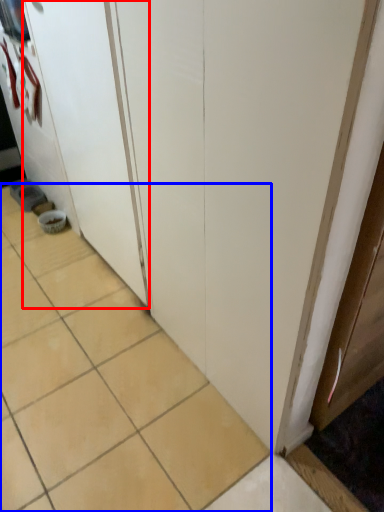
Question: Which object appears farthest to the camera in this image, screen door (highlighted by a red box) or ceramic tile (highlighted by a blue box)?

Choices:
 (A) screen door
 (B) ceramic tile

Answer: (A)